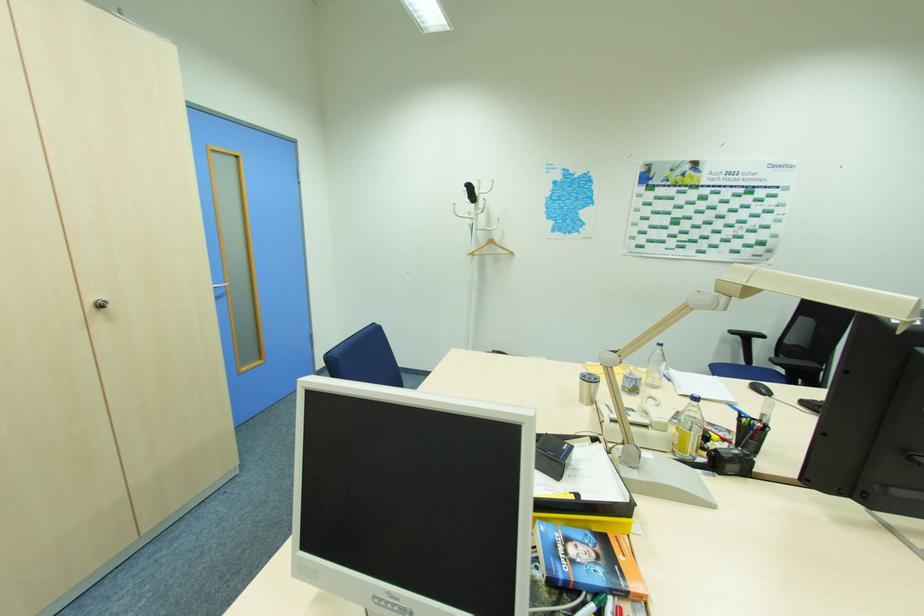
Identify the location of black chair armrest. The height and width of the screenshot is (616, 924). (764, 329).